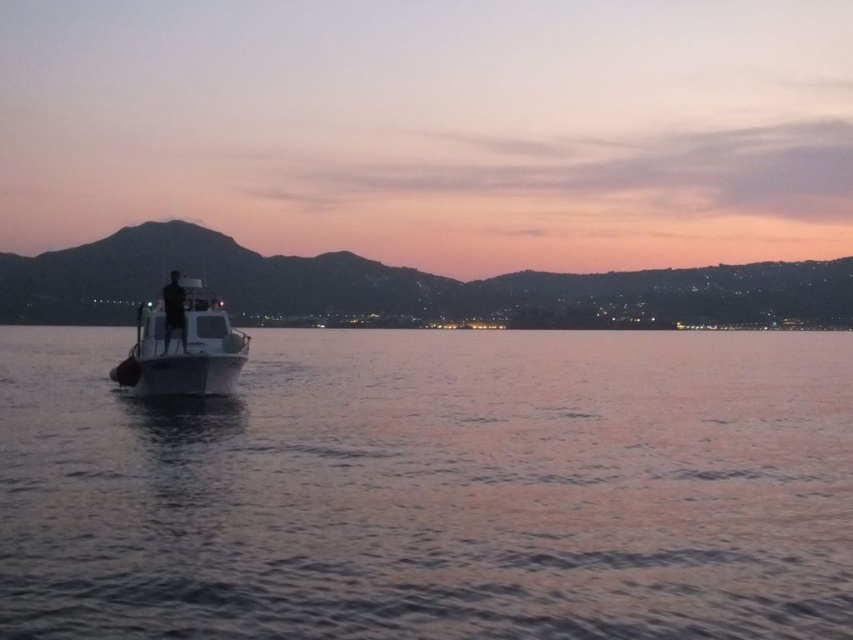
Who is lower down, smooth water at boat left or white glossy boat at center?

smooth water at boat left is lower down.

Is smooth water at boat left behind white glossy boat at center?

No, it is in front of white glossy boat at center.

Which is behind, point (780, 332) or point (138, 321)?

The point (780, 332) is behind.

In order to click on smooth water at boat left in this screenshot , I will do (433, 488).